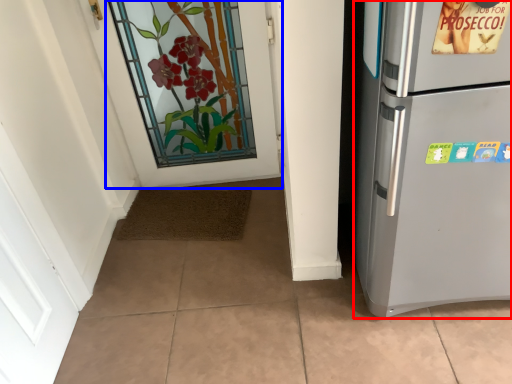
Question: Which object is further to the camera taking this photo, refrigerator (highlighted by a red box) or door (highlighted by a blue box)?

Choices:
 (A) refrigerator
 (B) door

Answer: (B)